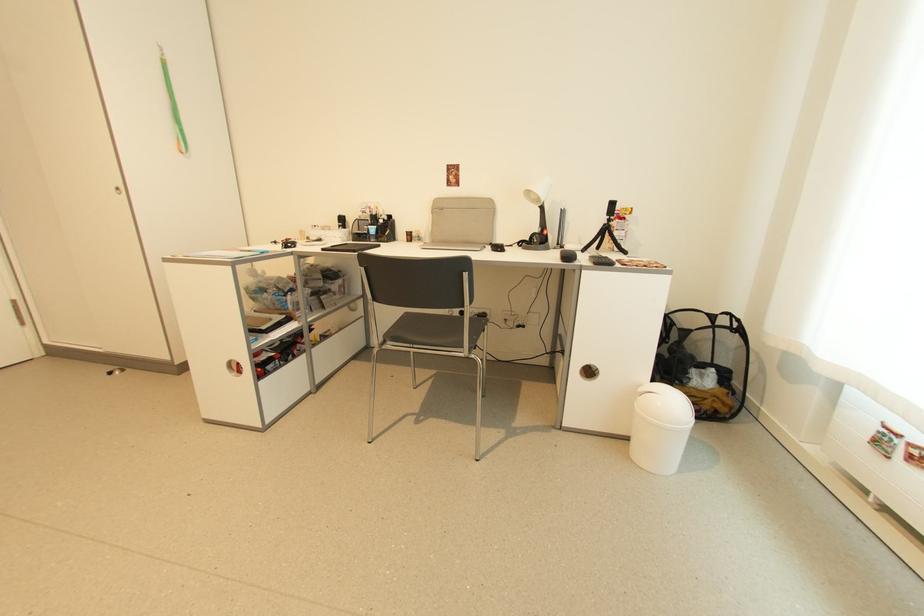
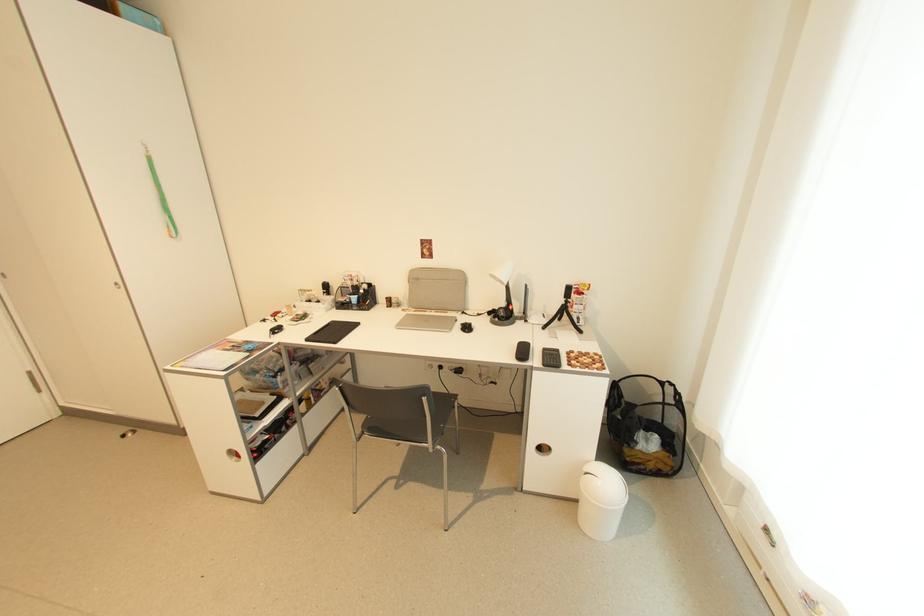
Where in the second image is the point corresponding to point (600, 265) from the first image?

(548, 367)